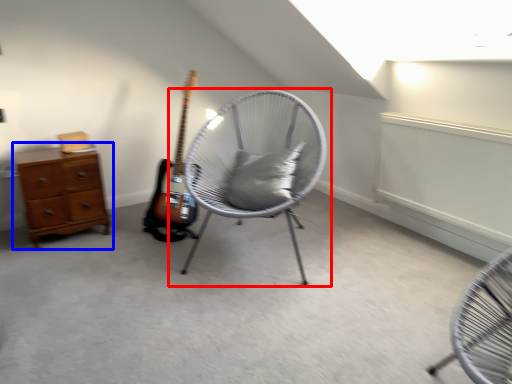
Question: Among these objects, which one is nearest to the camera, chair (highlighted by a red box) or chest of drawers (highlighted by a blue box)?

Choices:
 (A) chair
 (B) chest of drawers

Answer: (A)